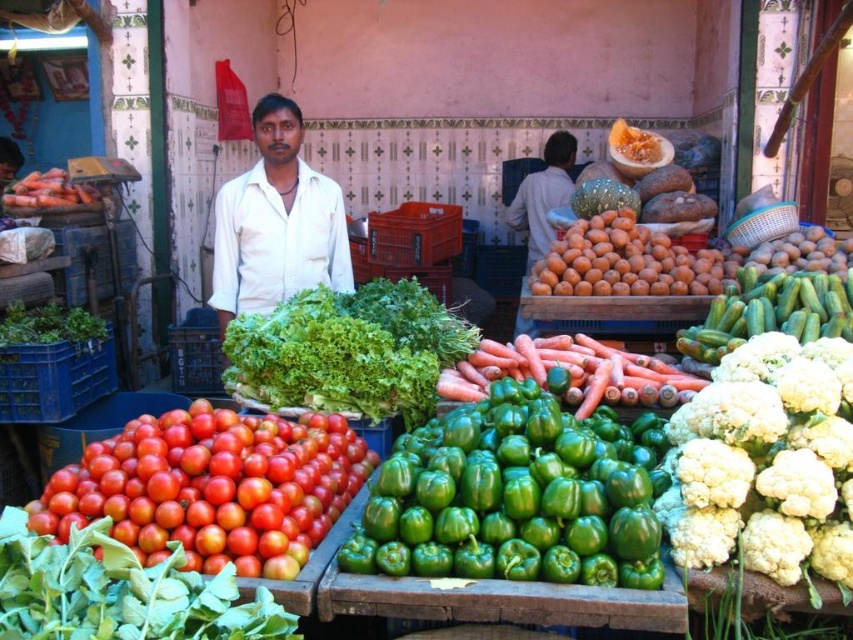
Question: Which of the following is the farthest from the observer?

Choices:
 (A) orange matte/orange at center
 (B) white fluffy cauliflower at right
 (C) red glossy tomatoes at lower left

Answer: (A)

Question: Estimate the real-world distances between objects in this image. Which object is farther from the orange matte/orange at center?

Choices:
 (A) shiny red tomatoes at lower left
 (B) orange matte carrots at center
 (C) orange matte carrots at left
 (D) green glossy bell pepper at center

Answer: (C)

Question: Can you confirm if green leafy at center is positioned above orange matte carrots at center?

Choices:
 (A) yes
 (B) no

Answer: (A)

Question: Is orange matte/orange at center in front of green leafy at left?

Choices:
 (A) yes
 (B) no

Answer: (B)

Question: Where is shiny red tomatoes at lower left located in relation to green leafy at center in the image?

Choices:
 (A) left
 (B) right

Answer: (A)

Question: Among these objects, which one is farthest from the camera?

Choices:
 (A) red glossy tomatoes at lower left
 (B) green glossy bell pepper at center
 (C) green leafy at center
 (D) white cotton shirt at center

Answer: (D)